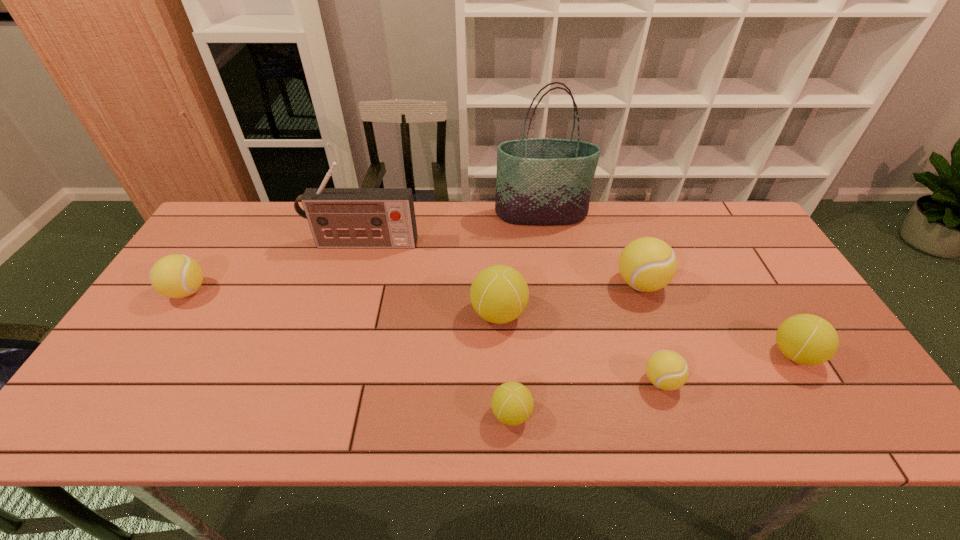
The height and width of the screenshot is (540, 960). What are the coordinates of `the smallest yellow tennis ball` in the screenshot? It's located at (667, 370).

Locate an element on the screen. the smallest green tennis ball is located at coordinates (512, 403).

Locate an element on the screen. This screenshot has width=960, height=540. vacant space located 0.320m on the right of the tote bag is located at coordinates (683, 214).

At what (x,y) coordinates should I click in order to perform the action: click on free location located 0.360m on the front panel of the second object from left to right. Please return your answer as a coordinate pair (x, y). The image size is (960, 540). Looking at the image, I should click on point(333,347).

Locate an element on the screen. vacant region located on the right of the biggest yellow tennis ball is located at coordinates (716, 284).

At what (x,y) coordinates should I click in order to perform the action: click on free region located 0.320m on the back of the biggest green tennis ball. Please return your answer as a coordinate pair (x, y). The width and height of the screenshot is (960, 540). Looking at the image, I should click on (495, 222).

Identify the location of vacant space located 0.150m on the front of the leftmost yellow tennis ball. The height and width of the screenshot is (540, 960). (148, 354).

This screenshot has width=960, height=540. I want to click on free space located 0.230m on the left of the second smallest green tennis ball, so tap(676, 354).

The height and width of the screenshot is (540, 960). I want to click on vacant area situated on the back of the nearest yellow tennis ball, so click(633, 295).

This screenshot has height=540, width=960. Find the location of `free region located 0.200m on the right of the smallest green tennis ball`. free region located 0.200m on the right of the smallest green tennis ball is located at coordinates (622, 414).